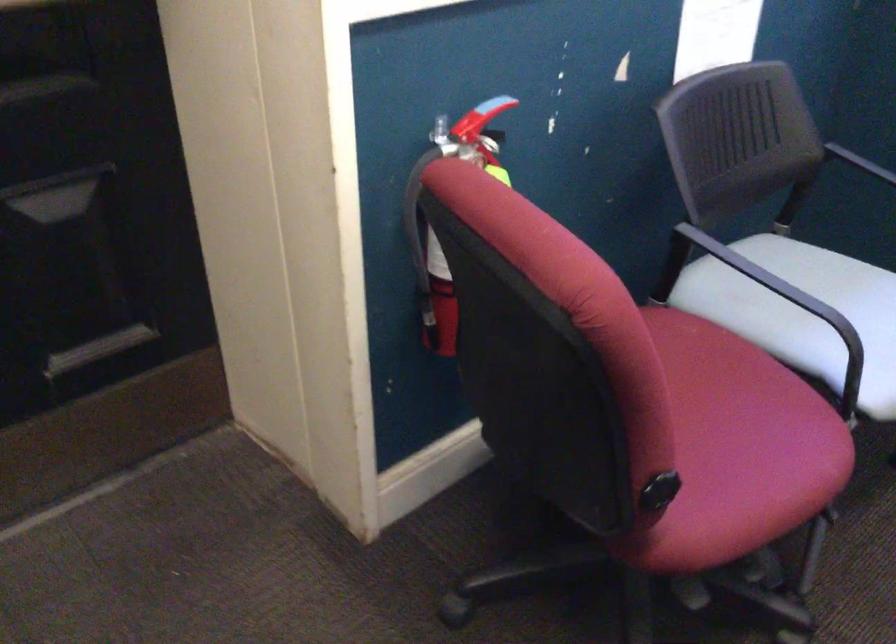
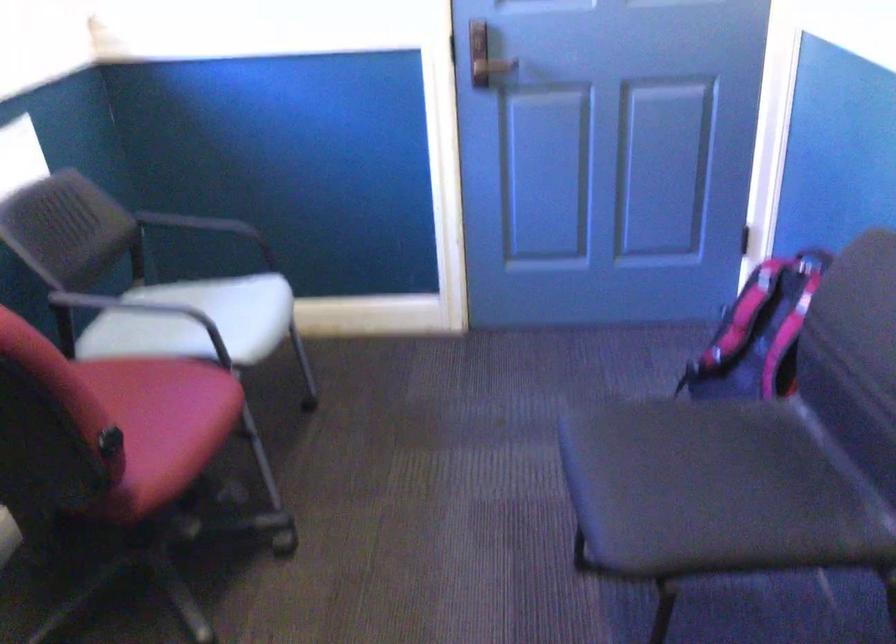
Locate, in the second image, the point that corresponds to (791,204) in the first image.

(145, 265)